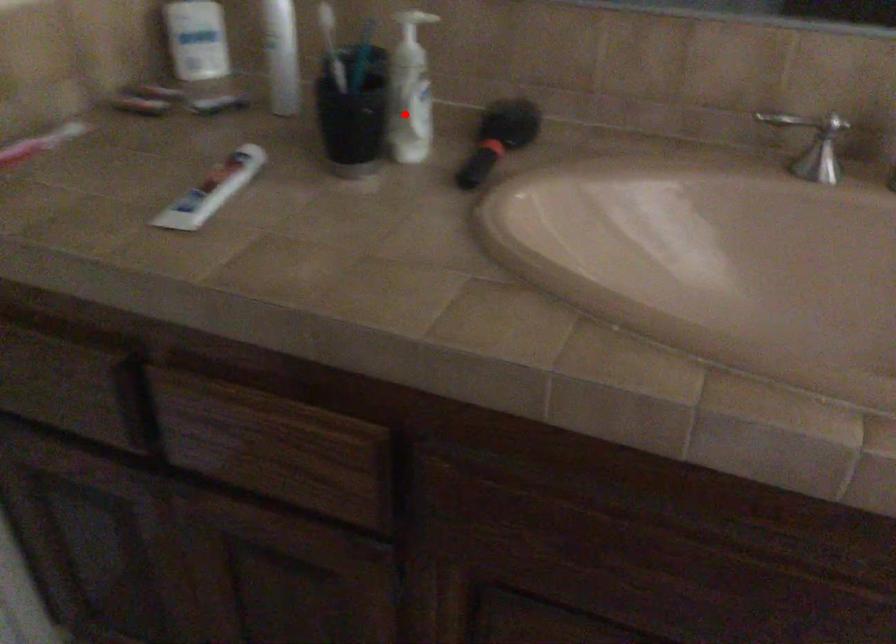
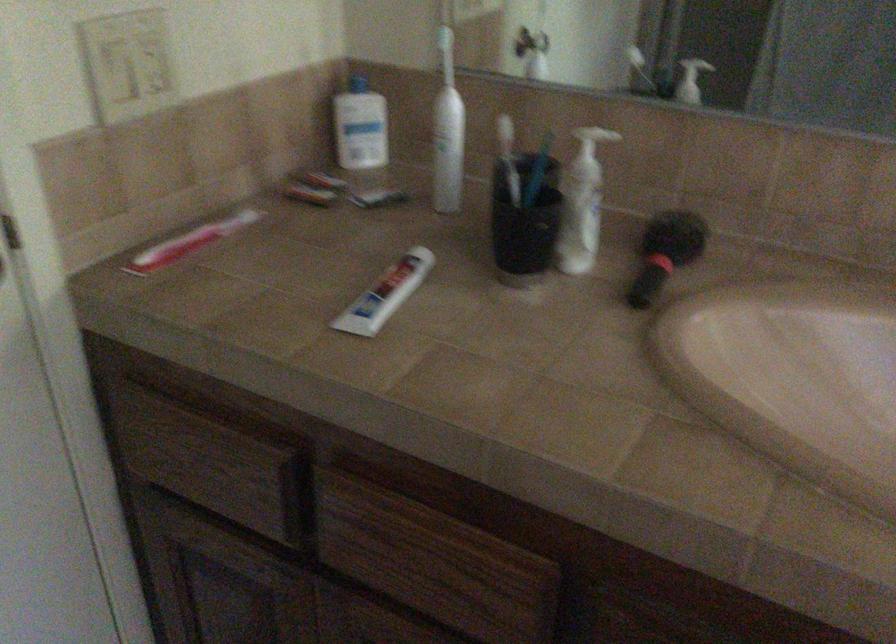
The point at the highlighted location is marked in the first image. Where is the corresponding point in the second image?

(579, 225)